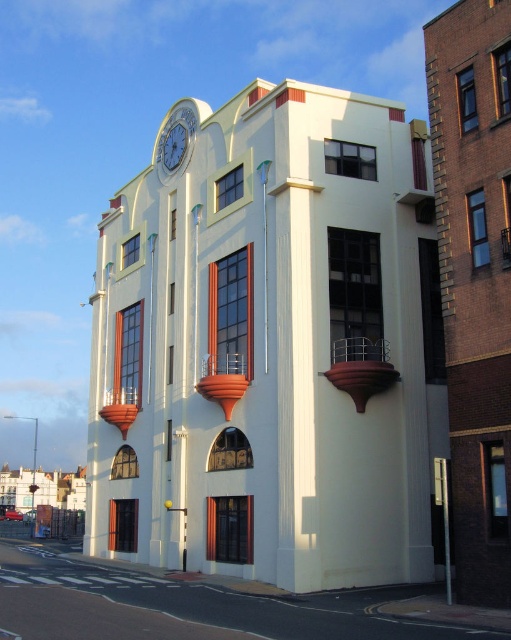
Can you confirm if white smooth clock tower at center is thinner than white glossy clock at upper center?

No, white smooth clock tower at center is not thinner than white glossy clock at upper center.

Which is more to the left, white smooth clock tower at center or white glossy clock at upper center?

white glossy clock at upper center

Is point (337, 307) positioned before point (188, 113)?

Yes, point (337, 307) is closer to viewer.

Where is `white smooth clock tower at center`? white smooth clock tower at center is located at coordinates (272, 348).

Which is more to the left, white glossy clock at upper center or blue glass clock at upper center?

white glossy clock at upper center

Is white glossy clock at upper center shorter than blue glass clock at upper center?

Incorrect, white glossy clock at upper center's height does not fall short of blue glass clock at upper center's.

The height and width of the screenshot is (640, 511). In order to click on white glossy clock at upper center in this screenshot , I will do `click(175, 141)`.

The height and width of the screenshot is (640, 511). What are the coordinates of `white glossy clock at upper center` in the screenshot? It's located at (x=175, y=141).

Who is more forward, (227, 323) or (172, 131)?

Point (227, 323)

Which of these two, white smooth clock tower at center or blue glass clock at upper center, stands shorter?

blue glass clock at upper center is shorter.

The height and width of the screenshot is (640, 511). What are the coordinates of `white smooth clock tower at center` in the screenshot? It's located at (272, 348).

Locate an element on the screen. The width and height of the screenshot is (511, 640). white smooth clock tower at center is located at coordinates (272, 348).